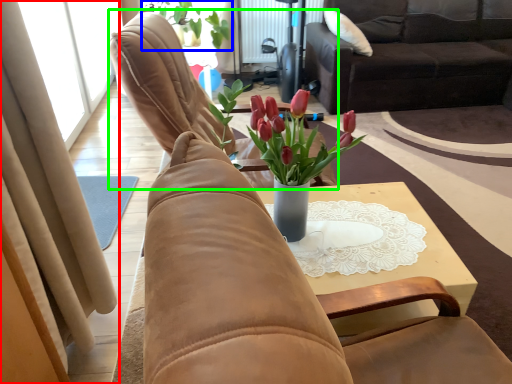
Question: Which is nearer to the curtain (highlighted by a red box)? houseplant (highlighted by a blue box) or chair (highlighted by a green box).

Choices:
 (A) houseplant
 (B) chair

Answer: (B)